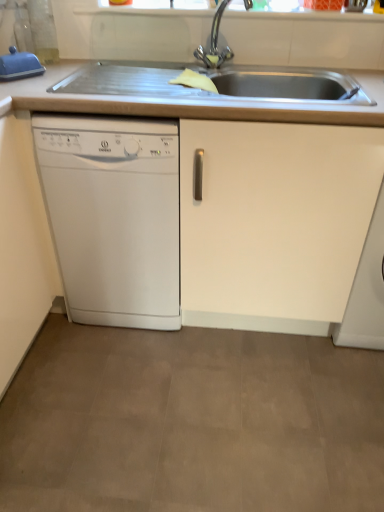
Question: Is white matte countertop at upper center in front of blue rubber glove at upper left?

Choices:
 (A) no
 (B) yes

Answer: (B)

Question: From the image's perspective, is white matte countertop at upper center beneath blue rubber glove at upper left?

Choices:
 (A) yes
 (B) no

Answer: (A)

Question: Is white matte countertop at upper center to the right of blue rubber glove at upper left from the viewer's perspective?

Choices:
 (A) yes
 (B) no

Answer: (A)

Question: Can we say white matte countertop at upper center lies outside blue rubber glove at upper left?

Choices:
 (A) no
 (B) yes

Answer: (B)

Question: Is white matte countertop at upper center bigger than blue rubber glove at upper left?

Choices:
 (A) yes
 (B) no

Answer: (A)

Question: From a real-world perspective, is white matte countertop at upper center positioned under blue rubber glove at upper left based on gravity?

Choices:
 (A) yes
 (B) no

Answer: (A)

Question: Is white matte countertop at upper center closer to camera compared to white plastic dishwasher at left?

Choices:
 (A) no
 (B) yes

Answer: (B)

Question: Considering the relative positions of white matte countertop at upper center and white plastic dishwasher at left in the image provided, is white matte countertop at upper center behind white plastic dishwasher at left?

Choices:
 (A) yes
 (B) no

Answer: (B)

Question: Is white matte countertop at upper center next to white plastic dishwasher at left?

Choices:
 (A) no
 (B) yes

Answer: (A)

Question: Does white matte countertop at upper center have a lesser height compared to white plastic dishwasher at left?

Choices:
 (A) no
 (B) yes

Answer: (B)

Question: Is white matte countertop at upper center thinner than white plastic dishwasher at left?

Choices:
 (A) yes
 (B) no

Answer: (A)

Question: From a real-world perspective, is white matte countertop at upper center over white plastic dishwasher at left?

Choices:
 (A) yes
 (B) no

Answer: (A)

Question: Considering the relative sizes of blue rubber glove at upper left and white matte countertop at upper center in the image provided, is blue rubber glove at upper left taller than white matte countertop at upper center?

Choices:
 (A) no
 (B) yes

Answer: (A)